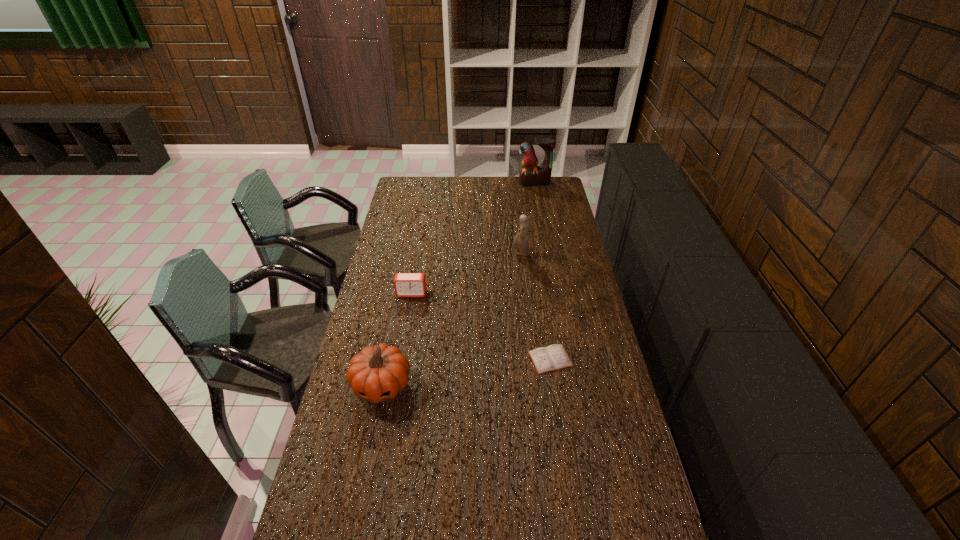
What are the coordinates of `free space located 0.330m on the front-facing side of the fourth shortest object` in the screenshot? It's located at (439, 253).

At what (x,y) coordinates should I click in order to perform the action: click on free space located 0.100m on the front-facing side of the fourth shortest object. Please return your answer as a coordinate pair (x, y). Looking at the image, I should click on (490, 253).

Where is `blank space located 0.100m on the face of the third tallest object`? blank space located 0.100m on the face of the third tallest object is located at coordinates (371, 441).

Locate an element on the screen. free space located 0.120m on the front-facing side of the third nearest object is located at coordinates click(x=407, y=320).

In order to click on vacant space located on the right of the shortest object in this screenshot , I will do `click(610, 359)`.

Where is `object present at the far edge`? This screenshot has height=540, width=960. object present at the far edge is located at coordinates (531, 175).

At what (x,y) coordinates should I click in order to perform the action: click on pumpkin positioned at the left edge. Please return your answer as a coordinate pair (x, y). Looking at the image, I should click on (378, 373).

Locate an element on the screen. alarm clock that is at the left edge is located at coordinates (406, 284).

You are a GUI agent. You are given a task and a screenshot of the screen. Output one action in this format:
    pyautogui.click(x=<x>, y=<y>)
    Task: Click on the parrot located at the right edge
    The height and width of the screenshot is (540, 960).
    Given the screenshot: What is the action you would take?
    pyautogui.click(x=531, y=175)

You are a GUI agent. You are given a task and a screenshot of the screen. Output one action in this format:
    pyautogui.click(x=<x>, y=<y>)
    Task: Click on the diary at the right edge
    This screenshot has height=540, width=960.
    Given the screenshot: What is the action you would take?
    pyautogui.click(x=553, y=357)